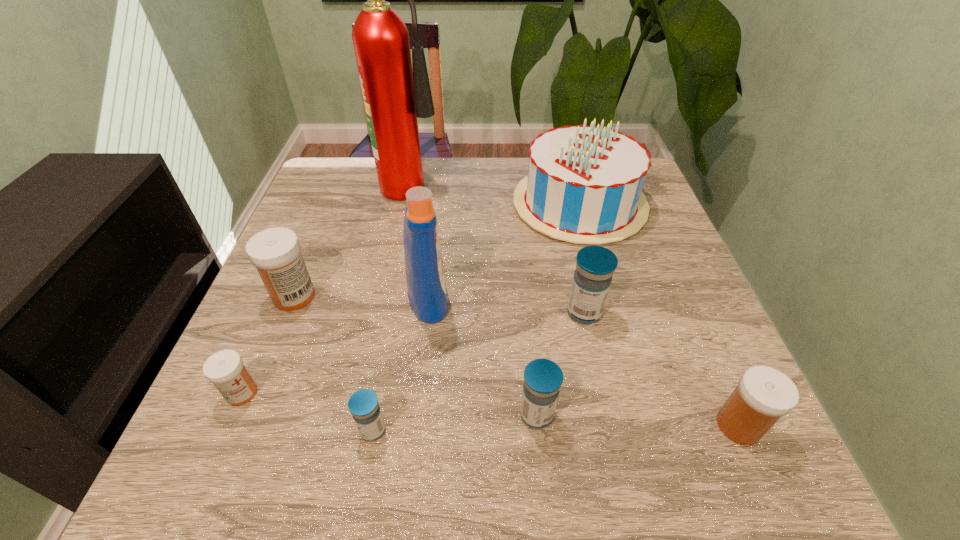
At what (x,y) coordinates should I click in order to perform the action: click on fire extinguisher. Please return your answer as a coordinate pair (x, y). Looking at the image, I should click on (394, 96).

Find the location of a particular element. This screenshot has width=960, height=540. the tallest object is located at coordinates (394, 96).

The width and height of the screenshot is (960, 540). In order to click on detergent in this screenshot , I will do `click(427, 293)`.

The width and height of the screenshot is (960, 540). Identify the location of the third tallest object. (584, 185).

Locate an element on the screen. Image resolution: width=960 pixels, height=540 pixels. white birthday cake is located at coordinates (584, 185).

Locate an element on the screen. The height and width of the screenshot is (540, 960). the farthest white medicine is located at coordinates (275, 252).

Locate an element on the screen. the rightmost blue medicine is located at coordinates click(595, 266).

The height and width of the screenshot is (540, 960). What are the coordinates of `the farthest blue medicine` in the screenshot? It's located at (595, 266).

Where is `the rightmost medicine`? The width and height of the screenshot is (960, 540). the rightmost medicine is located at coordinates (764, 394).

Identify the location of the second smallest white medicine. This screenshot has width=960, height=540. (764, 394).